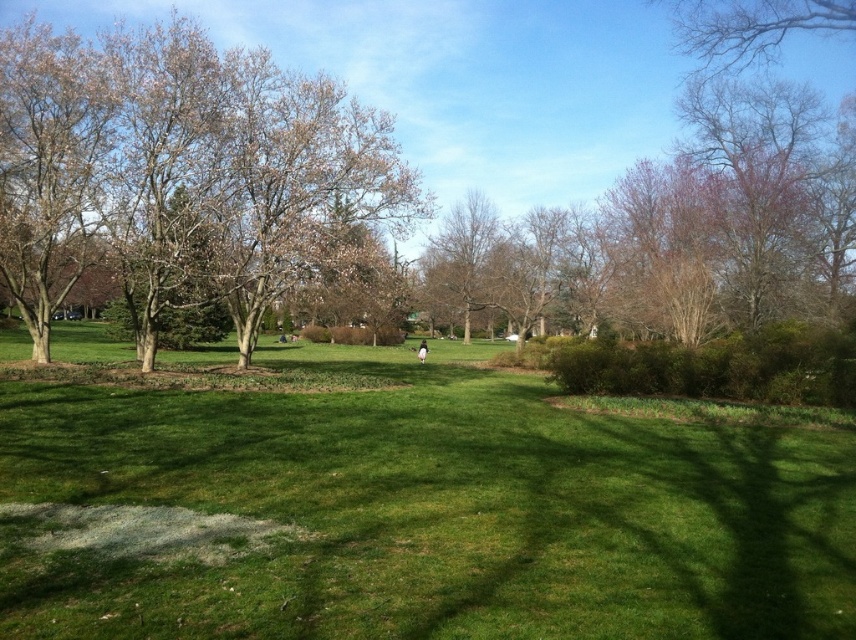
Is green grass at center to the right of bare branches at left from the viewer's perspective?

Indeed, green grass at center is positioned on the right side of bare branches at left.

Is green grass at center above bare branches at left?

No, green grass at center is not above bare branches at left.

Is point (492, 525) closer to viewer compared to point (364, 122)?

Yes, point (492, 525) is in front of point (364, 122).

This screenshot has height=640, width=856. Identify the location of green grass at center. (428, 512).